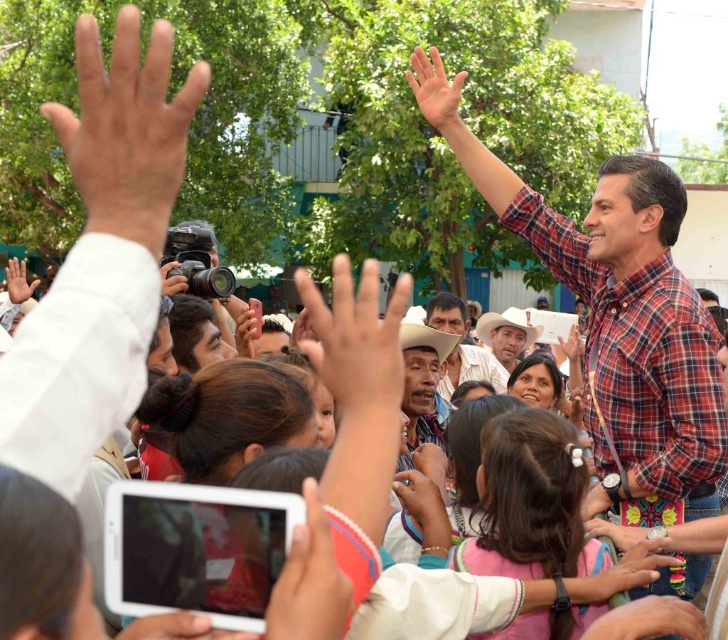
You are standing in the middle of the scene and want to move towards the two points. Which point, point (x=637, y=566) or point (x=25, y=289), will you reach first?

You will reach point (x=637, y=566) first because it is closer to the viewer than point (x=25, y=289).

From the picture: You are standing in the scene and want to move from point (x=440, y=122) to point (x=496, y=358). Which direction should you move to get closer to the camera?

To move closer to the camera, you should move towards point (x=440, y=122) because it is closer to the camera than point (x=496, y=358).

You are a photographer trying to capture a clear shot of the event. You notice the smooth white hand at center and the matte black camera at center in your viewfinder. Which object is closer to the camera lens?

The smooth white hand at center is positioned under the matte black camera at center, meaning the hand is closer to the camera lens.